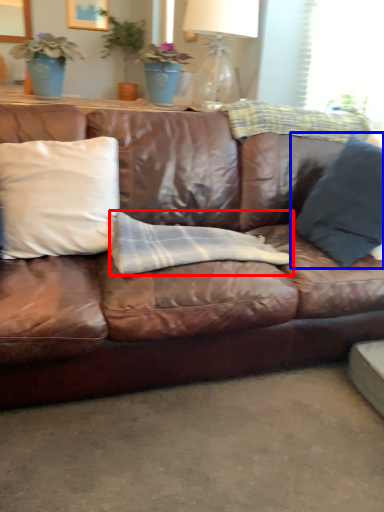
Question: Among these objects, which one is nearest to the camera, material (highlighted by a red box) or pillow (highlighted by a blue box)?

Choices:
 (A) material
 (B) pillow

Answer: (B)